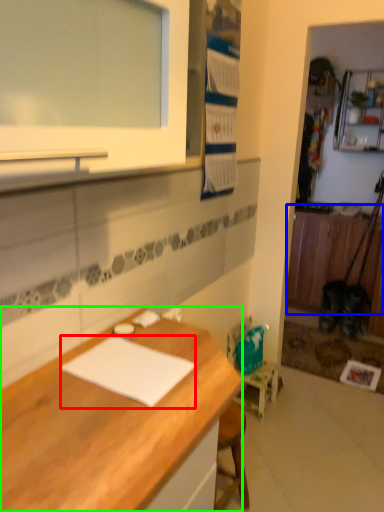
Question: Which object is the farthest from notepad (highlighted by a red box)? Choose among these: cabinetry (highlighted by a blue box) or desk (highlighted by a green box).

Choices:
 (A) cabinetry
 (B) desk

Answer: (A)